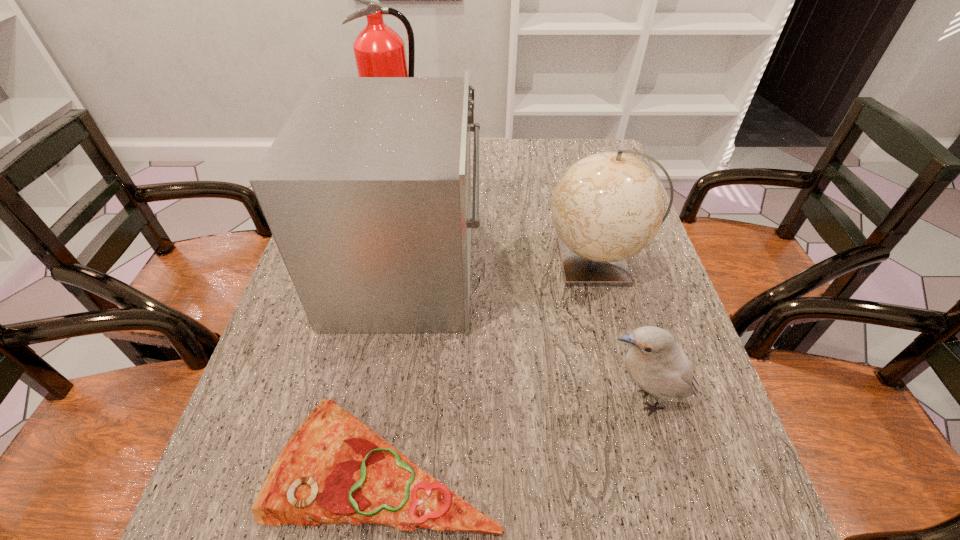
Where is `the farthest object`? the farthest object is located at coordinates (379, 51).

Locate an element on the screen. Image resolution: width=960 pixels, height=540 pixels. the second tallest object is located at coordinates (366, 190).

This screenshot has width=960, height=540. I want to click on globe, so click(608, 206).

The image size is (960, 540). I want to click on bird, so click(x=654, y=361).

What are the coordinates of `the shortest object` in the screenshot? It's located at (334, 469).

I want to click on free space located at the nozzle of the fire extinguisher, so click(x=392, y=177).

This screenshot has width=960, height=540. In order to click on free spot located 0.350m on the front panel of the fourth shortest object in this screenshot , I will do `click(619, 269)`.

Image resolution: width=960 pixels, height=540 pixels. I want to click on blank space located on the surface of the third shortest object showing Europe and Africa, so click(422, 263).

At what (x,y) coordinates should I click in order to perform the action: click on blank space located on the surface of the third shortest object showing Europe and Africa. Please return your answer as a coordinate pair (x, y). The width and height of the screenshot is (960, 540). Looking at the image, I should click on (473, 263).

The width and height of the screenshot is (960, 540). I want to click on free region located 0.190m on the surface of the third shortest object showing Europe and Africa, so click(x=469, y=263).